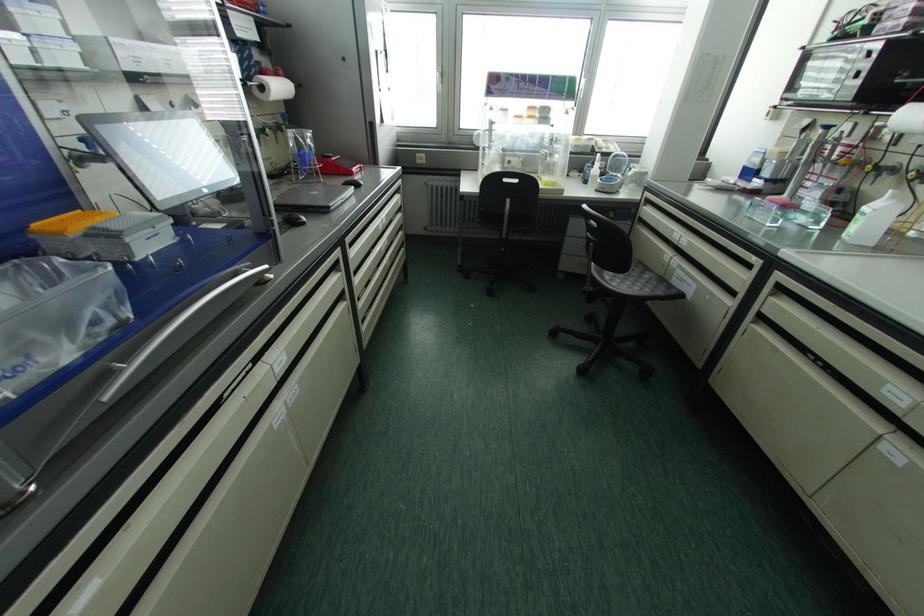
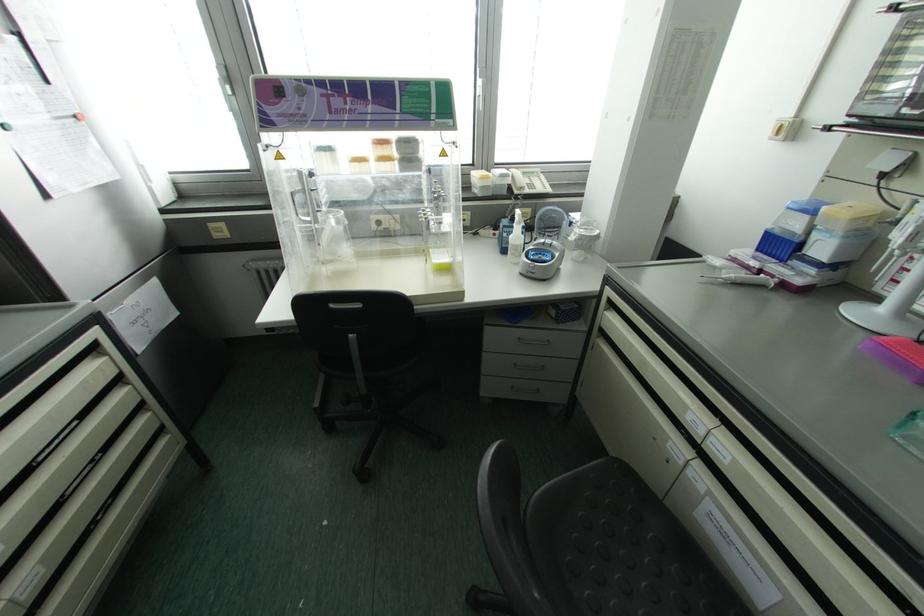
The images are taken continuously from a first-person perspective. In which direction are you moving?

The movement direction of the cameraman is right, forward.